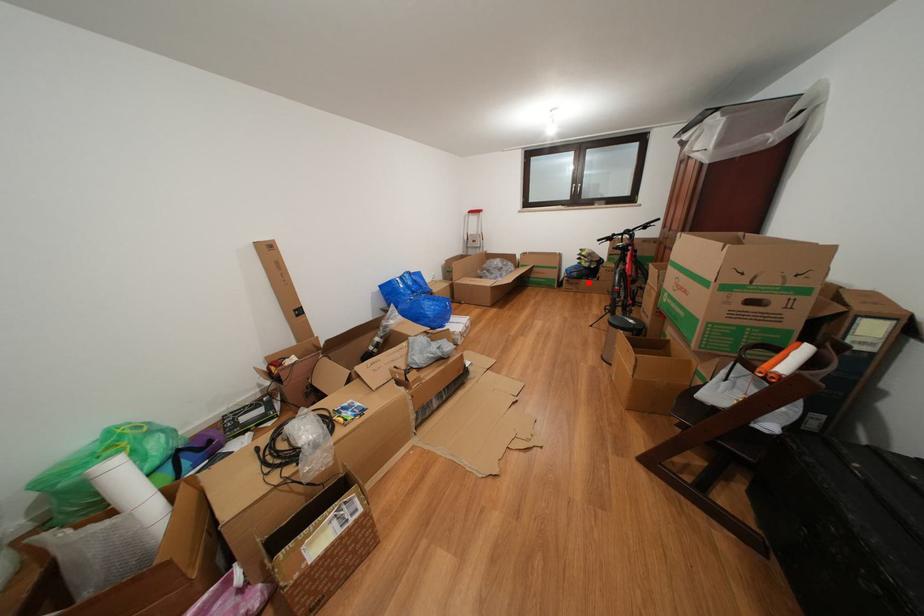
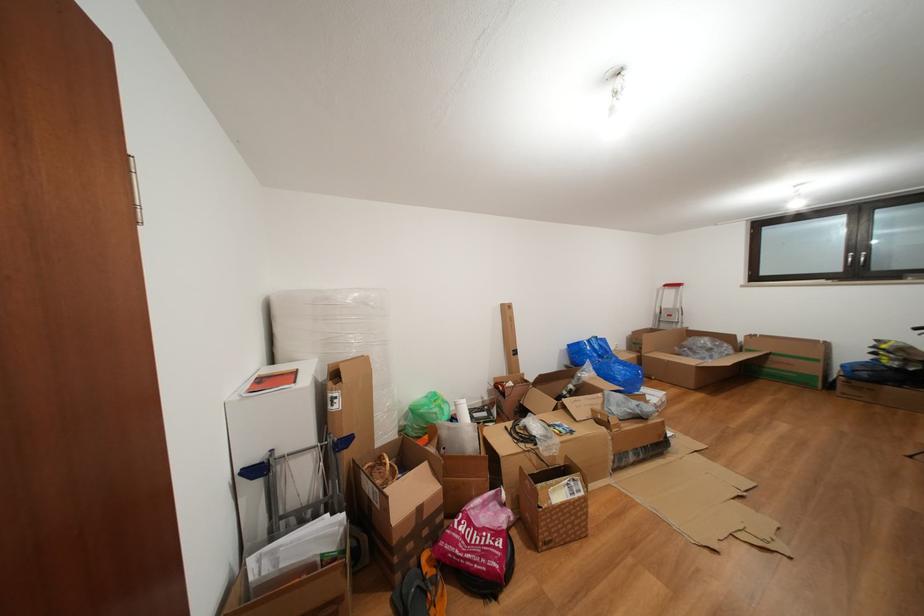
Question: I am providing you with two images of the same scene from different viewpoints. A red point is shown in image1. For the corresponding object point in image2, is it positioned nearer or farther from the camera?

Choices:
 (A) Nearer
 (B) Farther

Answer: (B)